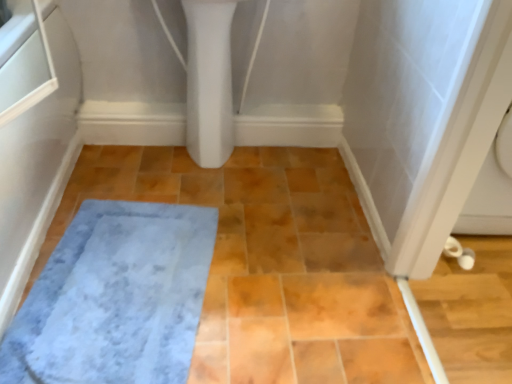
Locate an element on the screen. This screenshot has width=512, height=384. free space to the left of white glossy bidet at upper center is located at coordinates (162, 162).